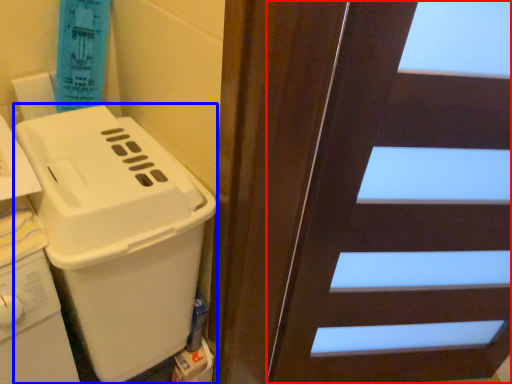
Question: Which object is closer to the camera taking this photo, door (highlighted by a red box) or appliance (highlighted by a blue box)?

Choices:
 (A) door
 (B) appliance

Answer: (A)